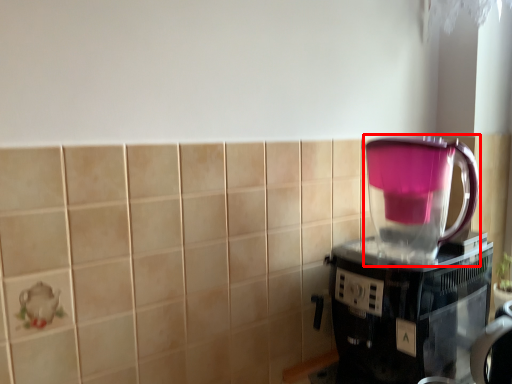
Question: Observing the image, what is the correct spatial positioning of blender (annotated by the red box) in reference to coffee maker?

Choices:
 (A) left
 (B) right

Answer: (A)